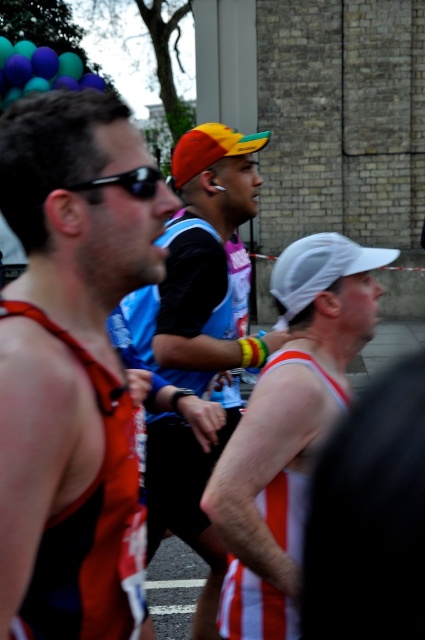
Question: Does white mesh cap at center have a smaller size compared to black plastic sunglasses at upper left?

Choices:
 (A) yes
 (B) no

Answer: (B)

Question: Considering the relative positions of matte orange tank top at left and black plastic sunglasses at upper left in the image provided, where is matte orange tank top at left located with respect to black plastic sunglasses at upper left?

Choices:
 (A) left
 (B) right

Answer: (A)

Question: Can you confirm if matte orange tank top at left is positioned to the left of orange fabric cap at center?

Choices:
 (A) yes
 (B) no

Answer: (A)

Question: Which point is closer to the camera?

Choices:
 (A) (115, 150)
 (B) (248, 156)
 (C) (62, 61)
 (D) (241, 637)

Answer: (A)

Question: Which point is closer to the camera taking this photo?

Choices:
 (A) (101, 440)
 (B) (346, 397)
 (C) (79, 84)
 (D) (215, 561)

Answer: (A)

Question: Based on their relative distances, which object is farther from the orange fabric cap at center?

Choices:
 (A) matte orange tank top at left
 (B) white mesh cap at center
 (C) black plastic sunglasses at upper left
 (D) translucent plastic balloons at upper left

Answer: (D)